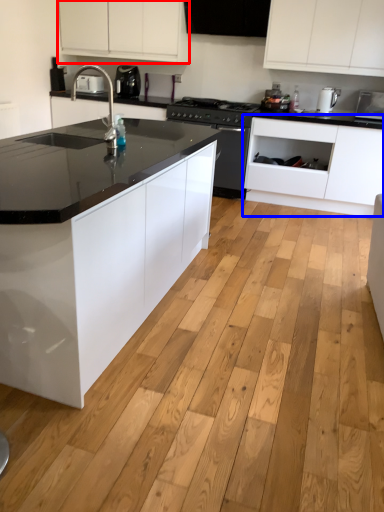
Question: Which of the following is the closest to the observer, cabinetry (highlighted by a red box) or cabinetry (highlighted by a blue box)?

Choices:
 (A) cabinetry
 (B) cabinetry

Answer: (B)